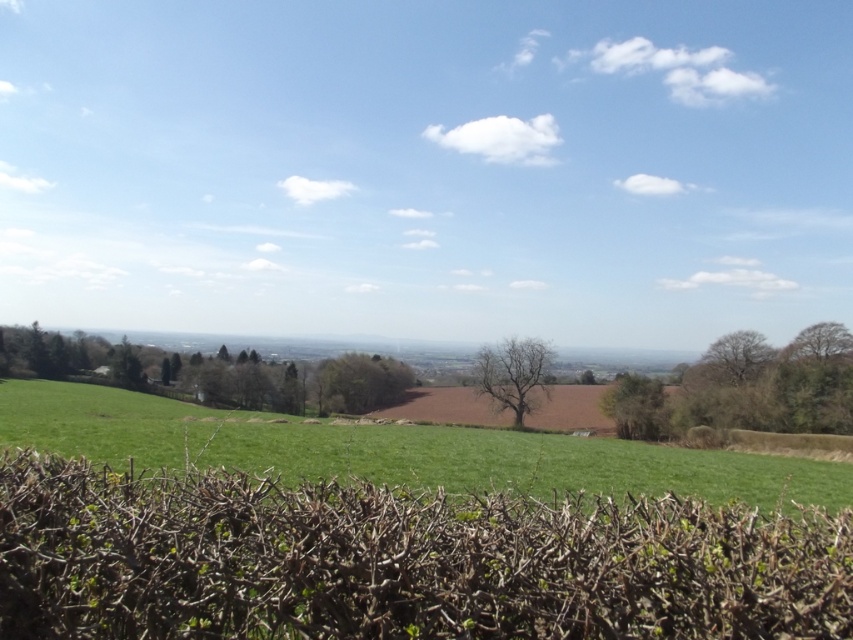
Consider the image. You are a photographer wanting to capture the green leafy tree at center without the brown dry hedge at lower center blocking it. How should you adjust your position relative to your current spot?

Move backward from your current position to ensure the brown dry hedge at lower center is no longer in front of the green leafy tree at center.

You are a landscape painter wanting to capture the scene accurately. You have to decide which area to focus on first based on their visual prominence. Which object should you paint first, the brown dry hedge at lower center or the green leafy tree at center?

The green leafy tree at center occupies more space than the brown dry hedge at lower center, so you should paint the green leafy tree at center first to ensure its prominence in the composition.

You are standing in the rural landscape and want to walk from the dense hedge in the foreground to the plowed field in the middle distance. Which object, the green grassy field at center or the bare branches at upper right, will you pass by first?

You will pass by the green grassy field at center first because it is located to the left of the bare branches at upper right, making it closer to your path from the dense hedge towards the plowed field.